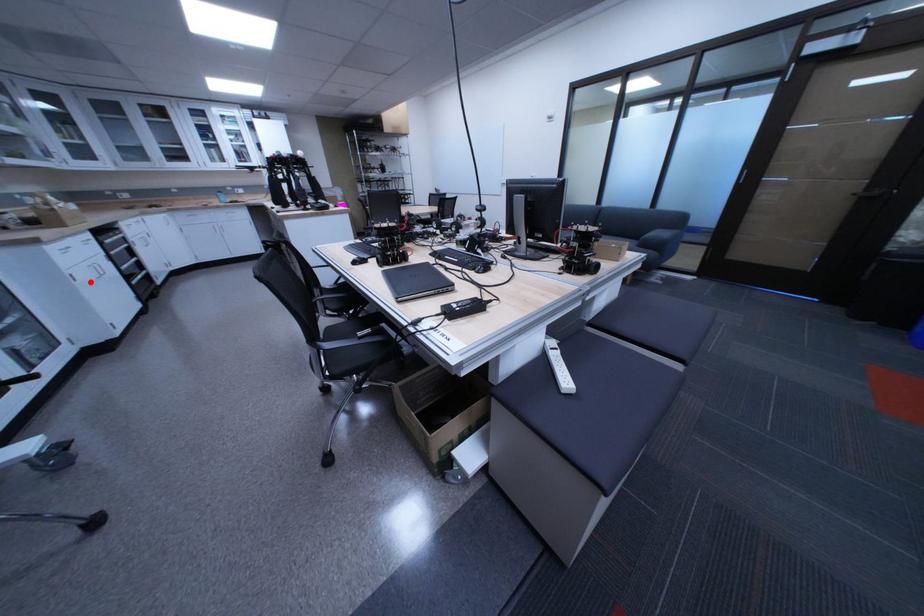
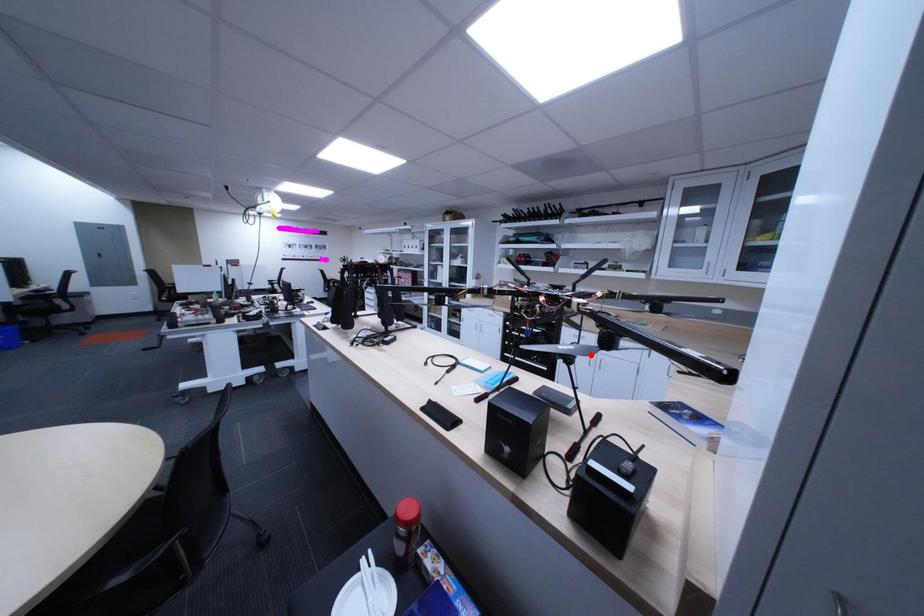
I am providing you with two images of the same scene from different viewpoints. A red point is marked on the first image and another point is marked on the second image. Do the highlighted points in image1 and image2 indicate the same real-world spot?

No